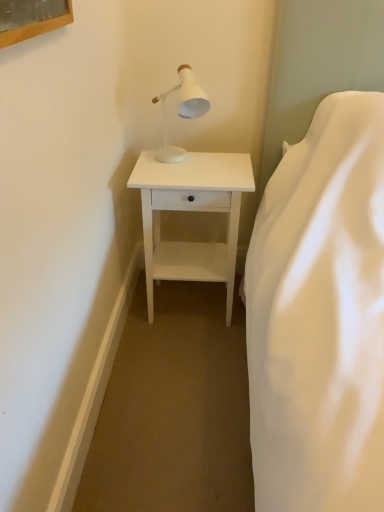
Find the location of a particular element. free location to the right of white matte table lamp at upper center is located at coordinates point(232,167).